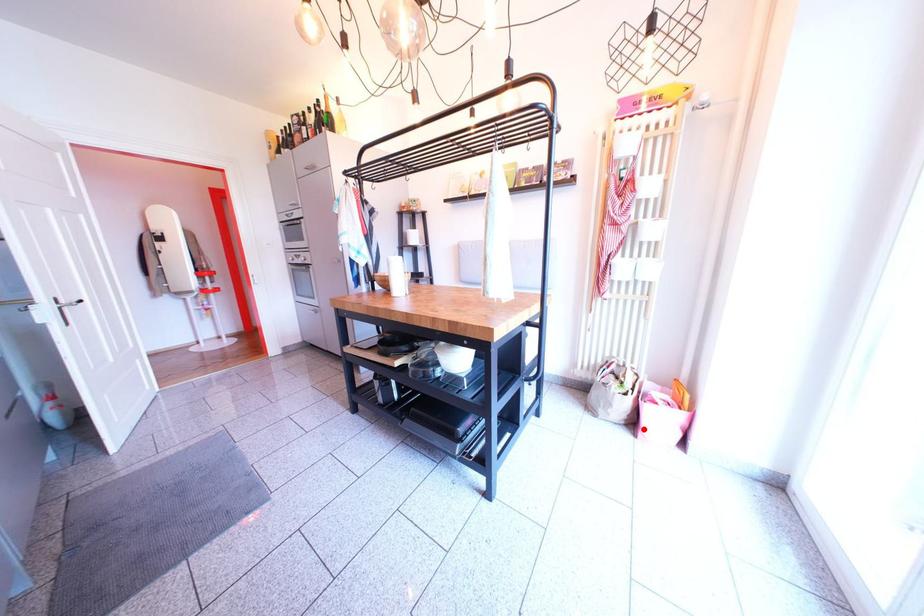
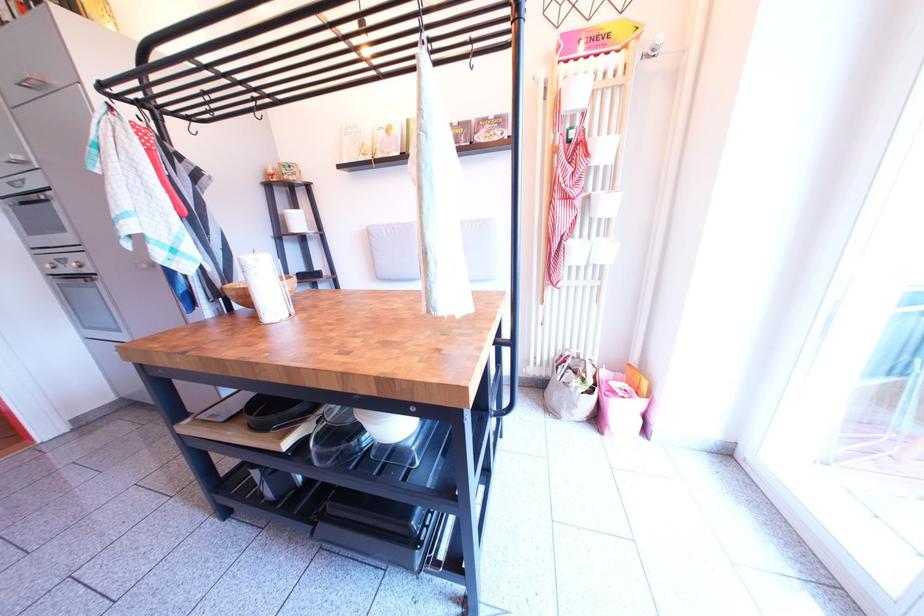
Find the pixel in the second image that matches the highlighted location in the first image.

(608, 426)